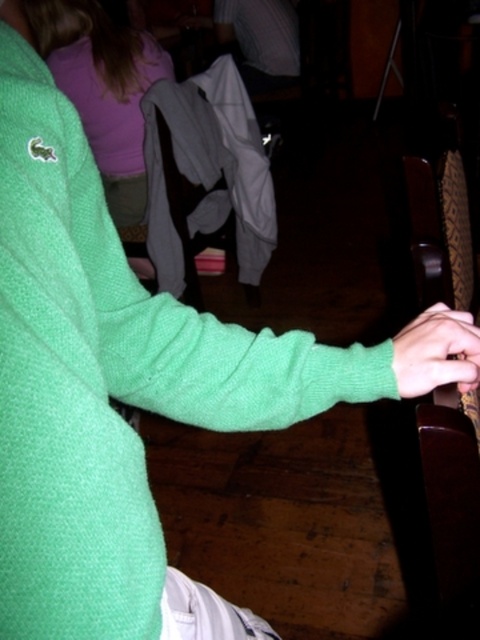
Can you confirm if matte green sweater at upper left is positioned above green fleece hand at lower right?

Indeed, matte green sweater at upper left is positioned over green fleece hand at lower right.

Describe the element at coordinates (104, 90) in the screenshot. This screenshot has height=640, width=480. I see `matte green sweater at upper left` at that location.

Locate an element on the screen. Image resolution: width=480 pixels, height=640 pixels. matte green sweater at upper left is located at coordinates (104, 90).